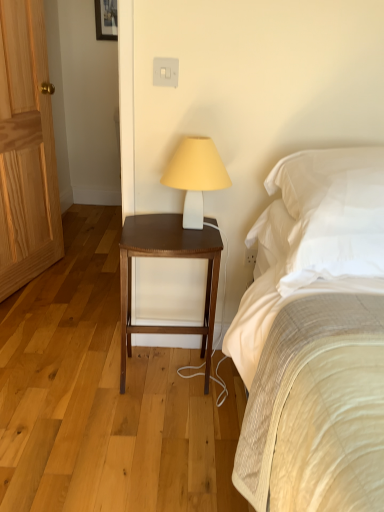
The width and height of the screenshot is (384, 512). Find the location of `free space to the right of natural wood door at left`. free space to the right of natural wood door at left is located at coordinates (75, 292).